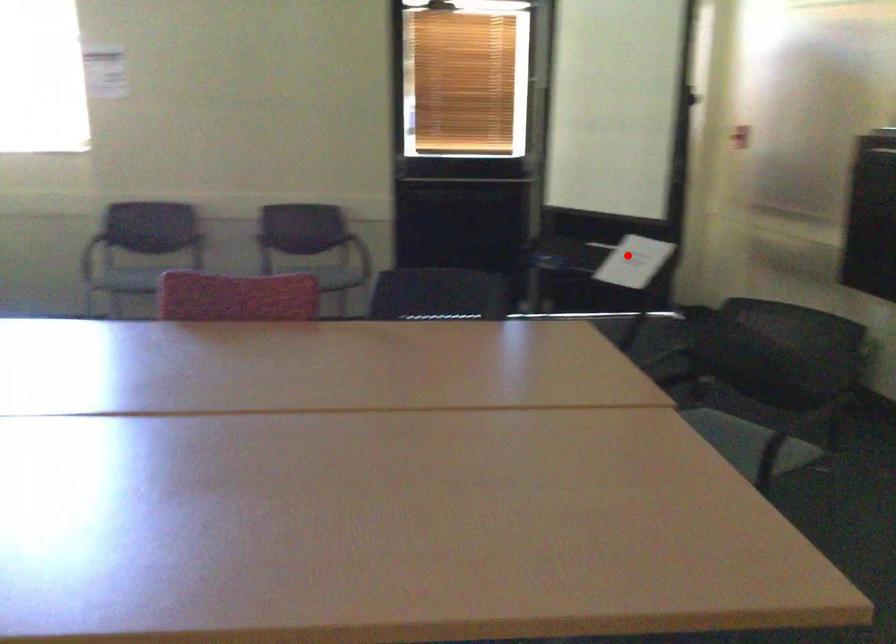
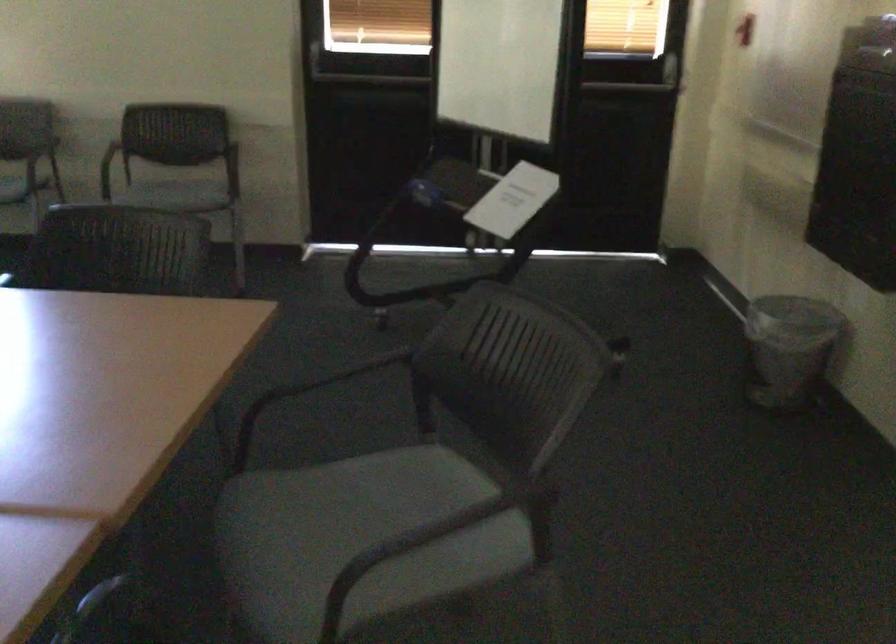
In the second image, find the point that corresponds to the highlighted location in the first image.

(513, 200)